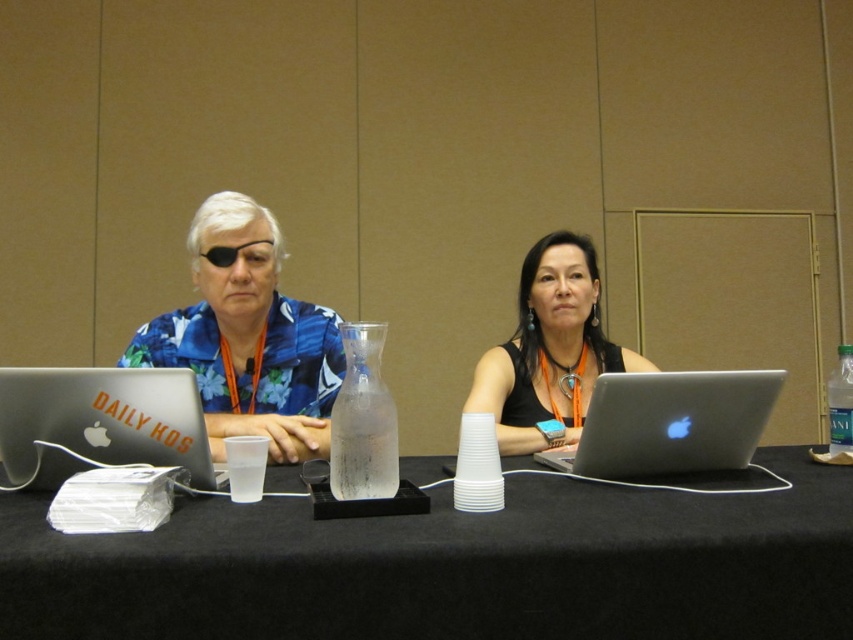
Can you confirm if blue floral shirt at left is shorter than matte silver laptop at left?

No.

Between point (262, 220) and point (10, 440), which one is positioned in front?

Point (10, 440)

Find the location of a particular element. The width and height of the screenshot is (853, 640). blue floral shirt at left is located at coordinates (248, 337).

I want to click on blue floral shirt at left, so click(x=248, y=337).

Looking at this image, who is more forward, (660,435) or (836,412)?

Positioned in front is point (660,435).

Based on the photo, is silver metallic laptop at center below clear glass bottle at right?

Yes.

The image size is (853, 640). I want to click on silver metallic laptop at center, so click(670, 422).

Does black matte table at center have a lesser height compared to blue floral shirt at left?

Yes, black matte table at center is shorter than blue floral shirt at left.

From the picture: Does black matte table at center appear over blue floral shirt at left?

No.

Is point (828, 550) farther from camera compared to point (265, 221)?

No, (828, 550) is closer to viewer.

The height and width of the screenshot is (640, 853). Find the location of `black matte table at center`. black matte table at center is located at coordinates (451, 566).